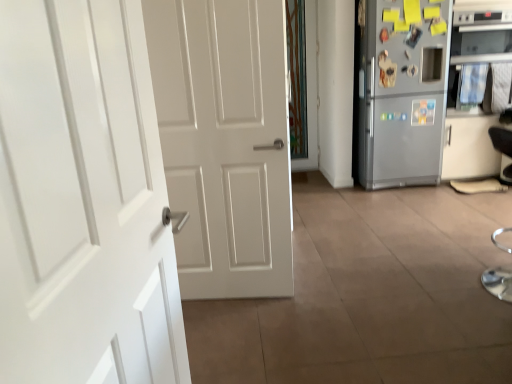
Question: Is silver metallic oven at right wider than black leather armchair at right?

Choices:
 (A) yes
 (B) no

Answer: (A)

Question: Is silver metallic oven at right not inside black leather armchair at right?

Choices:
 (A) no
 (B) yes

Answer: (B)

Question: Is silver metallic oven at right closer to the viewer compared to black leather armchair at right?

Choices:
 (A) yes
 (B) no

Answer: (B)

Question: Does silver metallic oven at right have a lesser height compared to black leather armchair at right?

Choices:
 (A) yes
 (B) no

Answer: (B)

Question: Is the position of silver metallic oven at right more distant than that of black leather armchair at right?

Choices:
 (A) no
 (B) yes

Answer: (B)

Question: Is silver metallic oven at right with black leather armchair at right?

Choices:
 (A) no
 (B) yes

Answer: (A)

Question: Considering the relative sizes of white glossy door at left and silver metallic refrigerator at right in the image provided, is white glossy door at left bigger than silver metallic refrigerator at right?

Choices:
 (A) yes
 (B) no

Answer: (B)

Question: From the image's perspective, is white glossy door at left below silver metallic refrigerator at right?

Choices:
 (A) no
 (B) yes

Answer: (B)

Question: Can you confirm if white glossy door at left is wider than silver metallic refrigerator at right?

Choices:
 (A) no
 (B) yes

Answer: (A)

Question: Would you say white glossy door at left is a long distance from silver metallic refrigerator at right?

Choices:
 (A) no
 (B) yes

Answer: (B)

Question: Is white glossy door at left outside of silver metallic refrigerator at right?

Choices:
 (A) yes
 (B) no

Answer: (A)

Question: Does white glossy door at left turn towards silver metallic refrigerator at right?

Choices:
 (A) yes
 (B) no

Answer: (B)

Question: Is black leather armchair at right surrounding white glossy door at left?

Choices:
 (A) yes
 (B) no

Answer: (B)